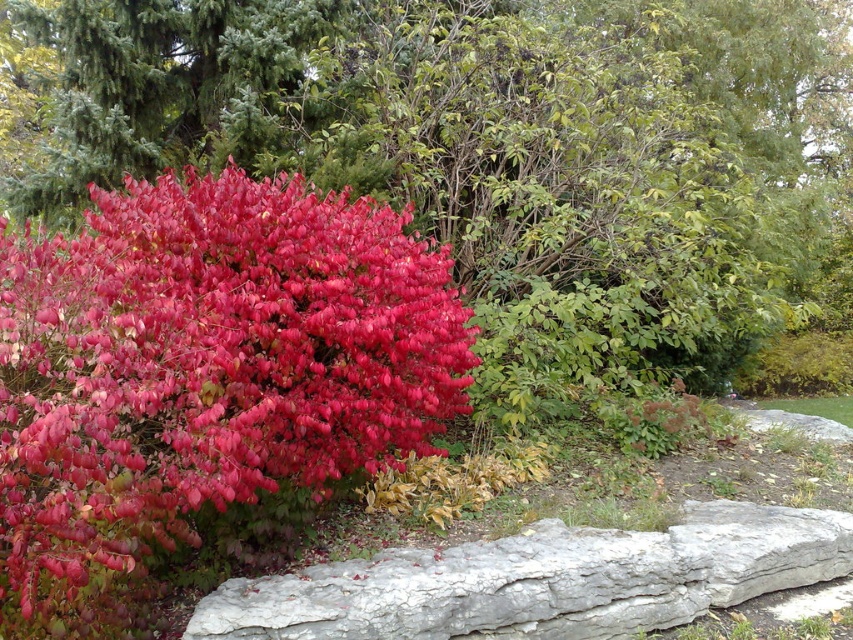
Who is more forward, [590,144] or [434,600]?

Point [434,600]

At what (x,y) coordinates should I click in order to perform the action: click on bright red leaves at center. Please return your answer as a coordinate pair (x, y). Looking at the image, I should click on (506, 163).

Does bright red leaves at center have a greater width compared to shiny red leaves at left?

Correct, the width of bright red leaves at center exceeds that of shiny red leaves at left.

Which is behind, point (335, 125) or point (50, 493)?

The point (335, 125) is more distant.

Is point (555, 228) positioned before point (15, 572)?

No, it is behind (15, 572).

Image resolution: width=853 pixels, height=640 pixels. Identify the location of bright red leaves at center. (506, 163).

Does shiny red leaves at left appear over gray rough stone at lower center?

Yes, shiny red leaves at left is above gray rough stone at lower center.

Is shiny red leaves at left closer to camera compared to gray rough stone at lower center?

Yes, shiny red leaves at left is in front of gray rough stone at lower center.

Is point (115, 564) behind point (799, 513)?

No.

In order to click on shiny red leaves at left in this screenshot , I will do `click(204, 369)`.